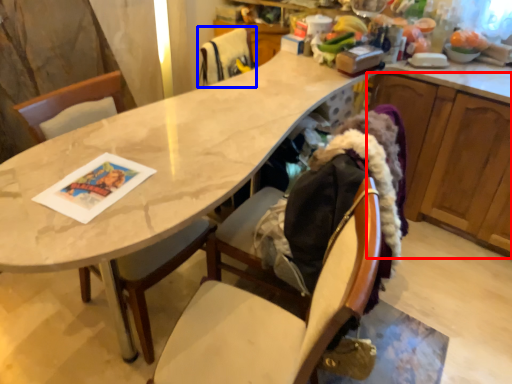
Question: Which object appears farthest to the camera in this image, cabinetry (highlighted by a red box) or chair (highlighted by a blue box)?

Choices:
 (A) cabinetry
 (B) chair

Answer: (B)